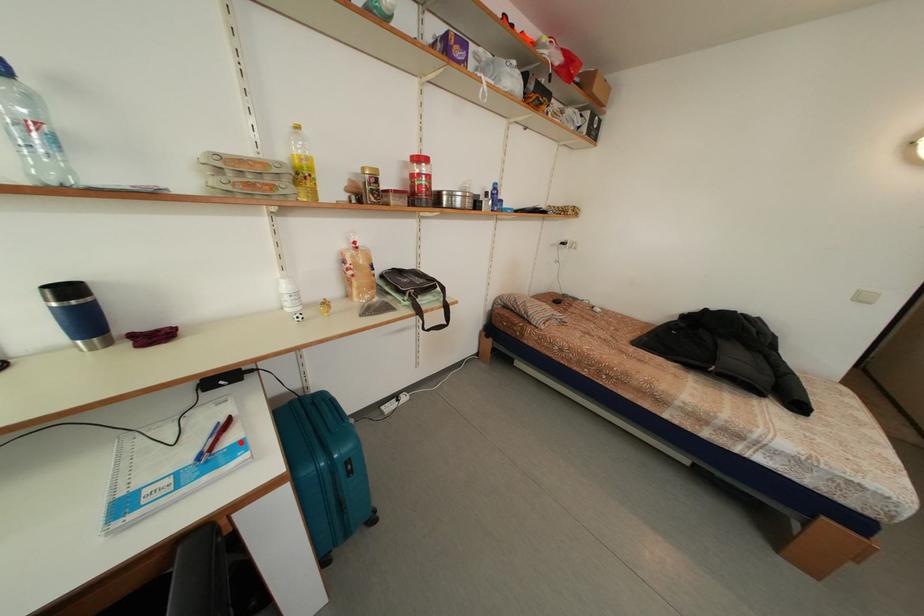
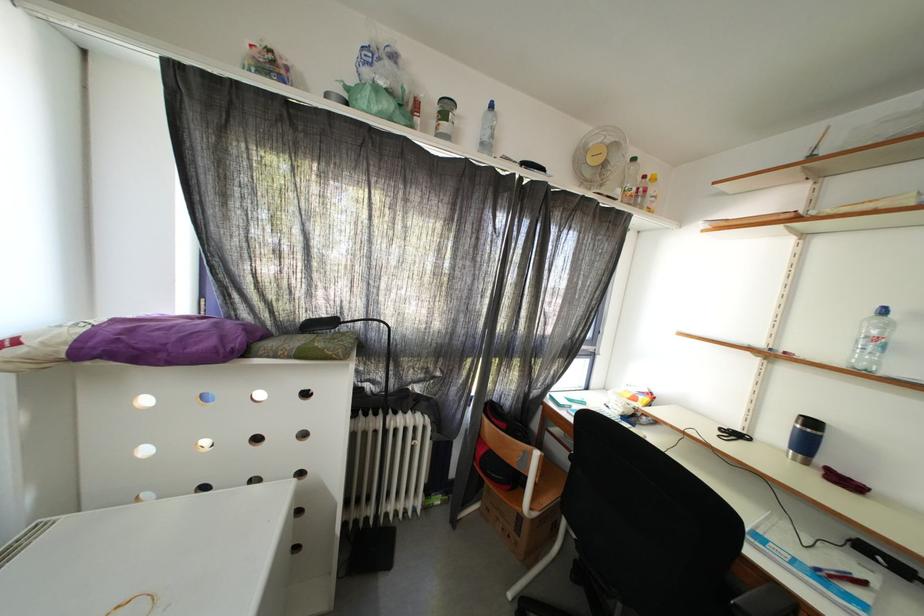
Question: A red point is marked in image1. In image2, is the corresponding 3D point closer to the camera or farther? Reply with the corresponding letter.

Choices:
 (A) The corresponding 3D point is closer.
 (B) The corresponding 3D point is farther.

Answer: (A)